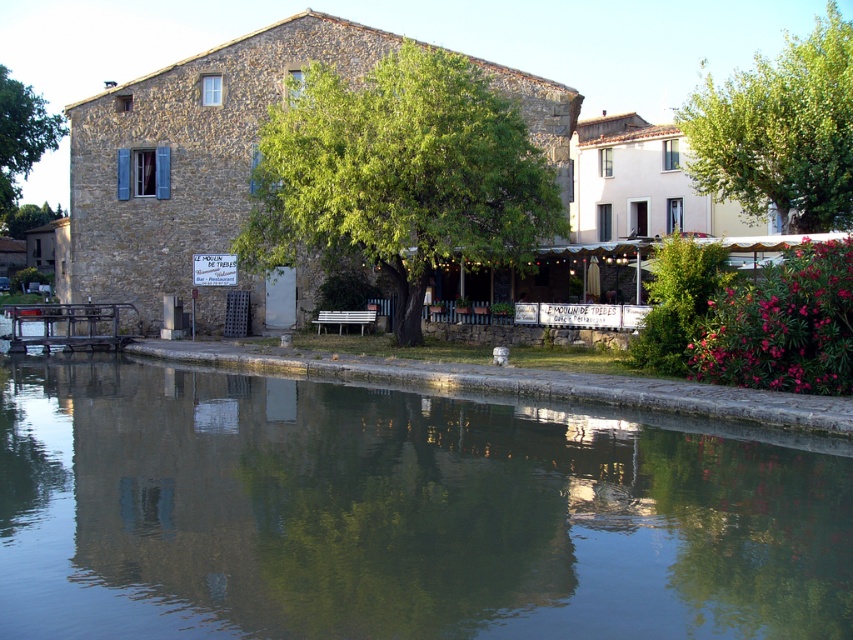
You are a tourist standing in front of the traditional stone building with a sloped roof. You notice the green reflective water at center and the green leafy tree at center. Which of these two objects takes up more space in the scene?

The green leafy tree at center occupies more space than the green reflective water at center.

You are standing in front of the traditional stone building and want to take a photo of both the green reflective water at center and the green leafy tree at upper right. Which object should you focus on first to ensure both are in the frame?

You should focus on the green reflective water at center first because it is closer to you than the green leafy tree at upper right, allowing both to be captured in the frame.